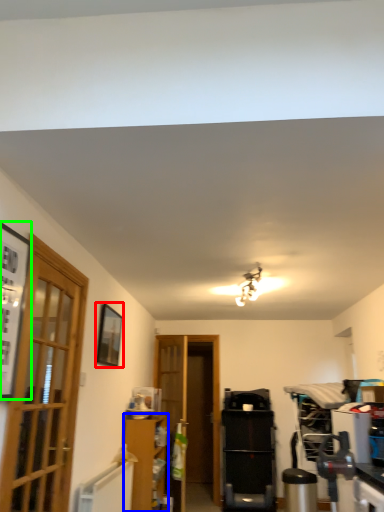
Question: Estimate the real-world distances between objects in this image. Which object is farther from picture frame (highlighted by a red box), cabinetry (highlighted by a blue box) or picture frame (highlighted by a green box)?

Choices:
 (A) cabinetry
 (B) picture frame

Answer: (B)